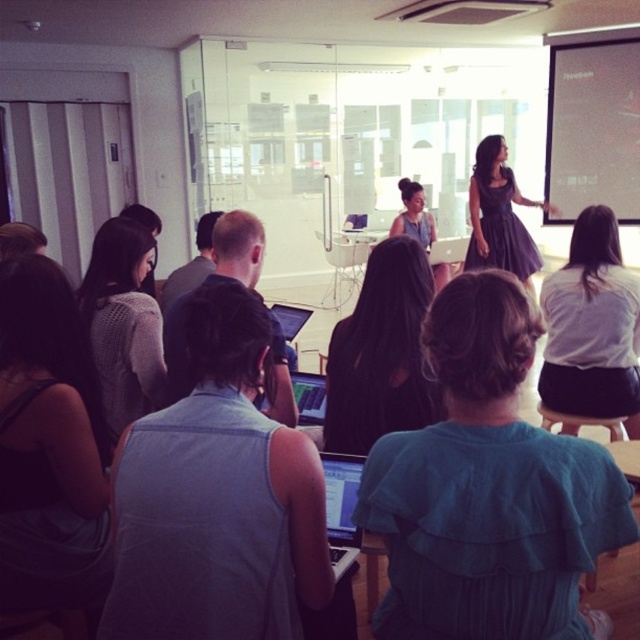
Can you confirm if knitted gray sweater at left is positioned above matte black laptop at center?

Correct, knitted gray sweater at left is located above matte black laptop at center.

Based on the photo, is knitted gray sweater at left smaller than matte black laptop at center?

No.

Is point (90, 269) farther from camera compared to point (337, 486)?

Yes, point (90, 269) is farther from viewer.

This screenshot has height=640, width=640. I want to click on knitted gray sweater at left, so click(x=124, y=323).

Between gray fabric shirt at center and black fabric dress at center, which one has less height?

Standing shorter between the two is black fabric dress at center.

Does gray fabric shirt at center have a smaller size compared to black fabric dress at center?

Indeed, gray fabric shirt at center has a smaller size compared to black fabric dress at center.

What do you see at coordinates (216, 499) in the screenshot?
I see `gray fabric shirt at center` at bounding box center [216, 499].

I want to click on gray fabric shirt at center, so click(216, 499).

Measure the distance from black fabric tank top at lower left to matte black laptop at center.

They are 72.09 centimeters apart.

Does black fabric tank top at lower left appear over matte black laptop at center?

Yes, black fabric tank top at lower left is above matte black laptop at center.

At what (x,y) coordinates should I click in order to perform the action: click on black fabric tank top at lower left. Please return your answer as a coordinate pair (x, y). Looking at the image, I should click on (49, 449).